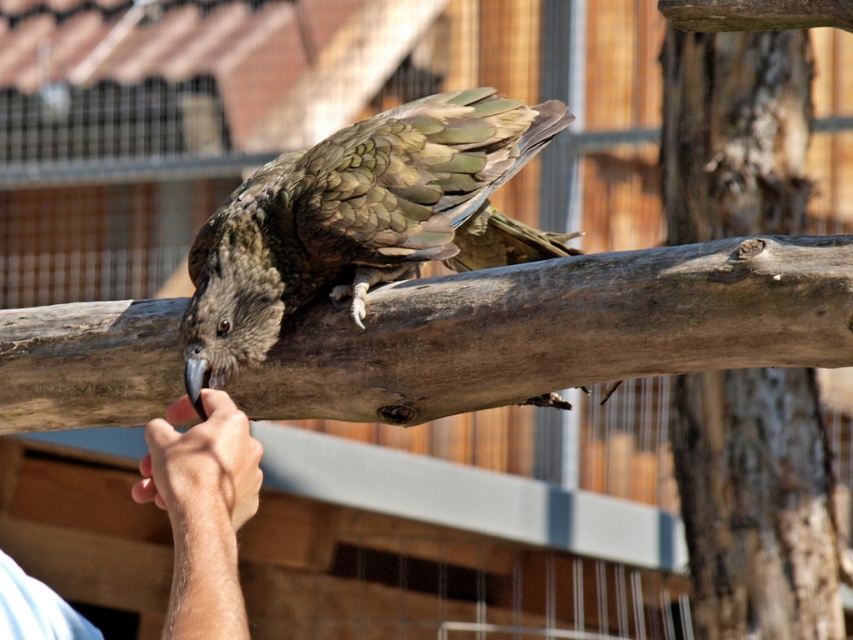
You are a park ranger standing at the entrance of an aviary. You need to place a food tray between the brown rough wood at center and the smooth brown log at center. The tray requires 3 meters of space. Can you fit it between them?

The distance between the brown rough wood at center and the smooth brown log at center is 2.50 meters. Since the required space for the food tray is 3 meters, the tray cannot be placed between them as there is insufficient space.